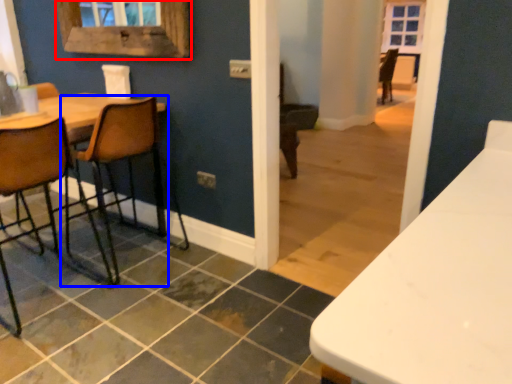
Question: Among these objects, which one is nearest to the camera, window frame (highlighted by a red box) or chair (highlighted by a blue box)?

Choices:
 (A) window frame
 (B) chair

Answer: (B)